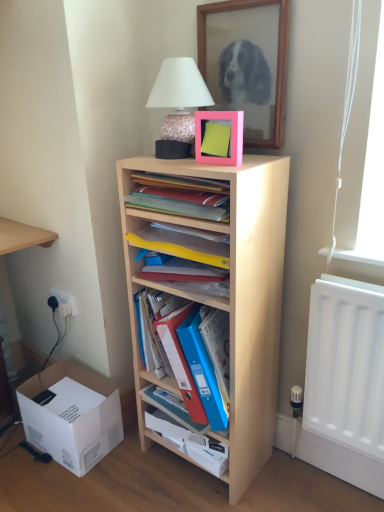
Where is `white plastic electric outlet at lower left, arranged as the second electric outlet when viewed from the left`? The width and height of the screenshot is (384, 512). white plastic electric outlet at lower left, arranged as the second electric outlet when viewed from the left is located at coordinates (65, 302).

At what (x,y) coordinates should I click in order to perform the action: click on blue plastic folders at center, which is the 1th shelf in bottom-to-top order. Please return your answer as a coordinate pair (x, y). Looking at the image, I should click on (186, 365).

Describe the element at coordinates (219, 137) in the screenshot. I see `pink matte picture frame at upper center` at that location.

This screenshot has width=384, height=512. Identify the location of light wood shelf at center, acting as the 3th shelf starting from the top. (223, 296).

What do you see at coordinates (223, 296) in the screenshot? I see `light wood shelf at center, the second shelf in the bottom-to-top sequence` at bounding box center [223, 296].

What do you see at coordinates (180, 196) in the screenshot?
I see `light wood shelves at center, which is the 1th shelf in top-to-bottom order` at bounding box center [180, 196].

Locate an element on the screen. The image size is (384, 512). white plastic electric outlet at lower left, the first electric outlet viewed from the right is located at coordinates (65, 302).

Is pink matte picture frame at upper center spatially inside white plastic electric outlet at lower left, arranged as the second electric outlet when viewed from the left, or outside of it?

pink matte picture frame at upper center is not inside white plastic electric outlet at lower left, arranged as the second electric outlet when viewed from the left, it's outside.

Does pink matte picture frame at upper center have a lesser width compared to white plastic electric outlet at lower left, arranged as the second electric outlet when viewed from the left?

In fact, pink matte picture frame at upper center might be wider than white plastic electric outlet at lower left, arranged as the second electric outlet when viewed from the left.

Considering the relative positions of pink matte picture frame at upper center and white plastic electric outlet at lower left, the first electric outlet viewed from the right, in the image provided, is pink matte picture frame at upper center to the right of white plastic electric outlet at lower left, the first electric outlet viewed from the right, from the viewer's perspective?

Yes, pink matte picture frame at upper center is to the right of white plastic electric outlet at lower left, the first electric outlet viewed from the right.

Image resolution: width=384 pixels, height=512 pixels. I want to click on picture frame above the white plastic electric outlet at lower left, arranged as the second electric outlet when viewed from the left (from the image's perspective), so click(x=219, y=137).

Can we say wooden framed mirror at upper center lies outside yellow paper at center, which is counted as the 3th shelf, starting from the bottom?

Indeed, wooden framed mirror at upper center is completely outside yellow paper at center, which is counted as the 3th shelf, starting from the bottom.

From the image's perspective, would you say wooden framed mirror at upper center is positioned over yellow paper at center, which is counted as the 3th shelf, starting from the bottom?

Yes.

Is wooden framed mirror at upper center oriented away from yellow paper at center, which is counted as the 3th shelf, starting from the bottom?

No.

Which of these two, wooden framed mirror at upper center or yellow paper at center, which is counted as the 3th shelf, starting from the bottom, stands taller?

With more height is wooden framed mirror at upper center.

Identify the location of mirror in front of the matte white lampshade at upper center. The image size is (384, 512). (277, 59).

Considering the sizes of objects matte white lampshade at upper center and wooden framed mirror at upper center in the image provided, who is taller, matte white lampshade at upper center or wooden framed mirror at upper center?

wooden framed mirror at upper center is taller.

Considering the sizes of objects matte white lampshade at upper center and wooden framed mirror at upper center in the image provided, who is wider, matte white lampshade at upper center or wooden framed mirror at upper center?

With larger width is matte white lampshade at upper center.

Is matte white lampshade at upper center positioned with its back to light wood shelves at center, the fourth shelf ordered from the bottom?

No, matte white lampshade at upper center's orientation is not away from light wood shelves at center, the fourth shelf ordered from the bottom.

Is matte white lampshade at upper center inside or outside of light wood shelves at center, which is the 1th shelf in top-to-bottom order?

matte white lampshade at upper center is outside light wood shelves at center, which is the 1th shelf in top-to-bottom order.

From the image's perspective, who appears lower, matte white lampshade at upper center or light wood shelves at center, the fourth shelf ordered from the bottom?

light wood shelves at center, the fourth shelf ordered from the bottom, appears lower in the image.

From the image's perspective, is blue plastic folders at center over wooden framed mirror at upper center?

No.

Considering the relative positions of blue plastic folders at center and wooden framed mirror at upper center in the image provided, is blue plastic folders at center to the left of wooden framed mirror at upper center from the viewer's perspective?

Yes.

Is the position of blue plastic folders at center more distant than that of wooden framed mirror at upper center?

Yes, it is behind wooden framed mirror at upper center.

How many degrees apart are the facing directions of blue plastic folders at center and wooden framed mirror at upper center?

The angular difference between blue plastic folders at center and wooden framed mirror at upper center is 0.22 degrees.

Is the position of white cardboard box at lower left less distant than that of blue plastic folders at center?

No, white cardboard box at lower left is further to the viewer.

Is white cardboard box at lower left far away from blue plastic folders at center?

Actually, white cardboard box at lower left and blue plastic folders at center are a little close together.

Looking at this image, from a real-world perspective, between white cardboard box at lower left and blue plastic folders at center, who is vertically higher?

blue plastic folders at center is physically above.

Is white cardboard box at lower left surrounding blue plastic folders at center?

No, blue plastic folders at center is not a part of white cardboard box at lower left.

Is pink matte picture frame at upper center positioned beyond the bounds of light wood shelf at center, acting as the 3th shelf starting from the top?

Yes, pink matte picture frame at upper center is not within light wood shelf at center, acting as the 3th shelf starting from the top.

Find the location of a particular element. picture frame above the light wood shelf at center, the second shelf in the bottom-to-top sequence (from a real-world perspective) is located at coordinates (219, 137).

Can you see pink matte picture frame at upper center touching light wood shelf at center, acting as the 3th shelf starting from the top?

pink matte picture frame at upper center and light wood shelf at center, acting as the 3th shelf starting from the top, are not in contact.

Who is shorter, pink matte picture frame at upper center or light wood shelf at center, the second shelf in the bottom-to-top sequence?

pink matte picture frame at upper center is shorter.

Where is `picture frame above the white plastic electric outlet at lower left, arranged as the second electric outlet when viewed from the left (from a real-world perspective)`? Image resolution: width=384 pixels, height=512 pixels. picture frame above the white plastic electric outlet at lower left, arranged as the second electric outlet when viewed from the left (from a real-world perspective) is located at coordinates (219, 137).

The height and width of the screenshot is (512, 384). What are the coordinates of `shelf that appears behind the wooden framed mirror at upper center` in the screenshot? It's located at (186, 260).

In the scene shown: Considering their positions, is white cardboard box at lower left positioned further to white plastic electric outlet at lower left, the first electric outlet in the left-to-right sequence, than wooden framed mirror at upper center?

Based on the image, wooden framed mirror at upper center appears to be further to white plastic electric outlet at lower left, the first electric outlet in the left-to-right sequence.

When comparing their distances from light wood shelf at center, the second shelf in the bottom-to-top sequence, does blue plastic folders at center, which is the 1th shelf in bottom-to-top order, or matte white lampshade at upper center seem further?

matte white lampshade at upper center.

Based on their spatial positions, is white plastic electric outlet at lower left, arranged as the second electric outlet when viewed from the left, or white cardboard box at lower left further from blue plastic folders at center?

Result: The object further to blue plastic folders at center is white plastic electric outlet at lower left, arranged as the second electric outlet when viewed from the left.

Considering their positions, is yellow paper at center, which is counted as the 3th shelf, starting from the bottom, positioned further to blue plastic folders at center than white cardboard box at lower left?

Among the two, yellow paper at center, which is counted as the 3th shelf, starting from the bottom, is located further to blue plastic folders at center.

Which object lies further to the anchor point pink matte picture frame at upper center, light wood shelves at center, which is the 1th shelf in top-to-bottom order, or wooden framed mirror at upper center?

Among the two, wooden framed mirror at upper center is located further to pink matte picture frame at upper center.

Which object lies further to the anchor point matte white lampshade at upper center, light wood shelf at center, the second shelf in the bottom-to-top sequence, or pink matte picture frame at upper center?

light wood shelf at center, the second shelf in the bottom-to-top sequence, is positioned further to the anchor matte white lampshade at upper center.

Looking at the image, which one is located further to white cardboard box at lower left, white plastic electric outlet at lower left, arranged as the second electric outlet when viewed from the left, or white plastic electric outlet at lower left, the first electric outlet in the left-to-right sequence?

The object further to white cardboard box at lower left is white plastic electric outlet at lower left, the first electric outlet in the left-to-right sequence.

From the image, which object appears to be nearer to blue plastic folders at center, matte white lampshade at upper center or pink matte picture frame at upper center?

pink matte picture frame at upper center is closer to blue plastic folders at center.

This screenshot has height=512, width=384. I want to click on table lamp that lies between wooden framed mirror at upper center and light wood shelf at center, the second shelf in the bottom-to-top sequence, from top to bottom, so click(178, 102).

This screenshot has width=384, height=512. In order to click on shelf between yellow paper at center, positioned as the 2th shelf in top-to-bottom order, and blue plastic folders at center, which is the 1th shelf in bottom-to-top order, vertically in this screenshot , I will do `click(223, 296)`.

Locate an element on the screen. Image resolution: width=384 pixels, height=512 pixels. picture frame between matte white lampshade at upper center and yellow paper at center, positioned as the 2th shelf in top-to-bottom order, in the up-down direction is located at coordinates (219, 137).

Locate an element on the screen. Image resolution: width=384 pixels, height=512 pixels. table lamp between pink matte picture frame at upper center and white plastic electric outlet at lower left, the first electric outlet viewed from the right, from front to back is located at coordinates (178, 102).